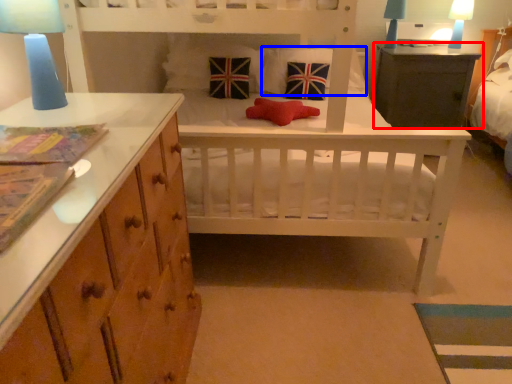
Question: Which object is closer to the camera taking this photo, table (highlighted by a red box) or pillow (highlighted by a blue box)?

Choices:
 (A) table
 (B) pillow

Answer: (B)